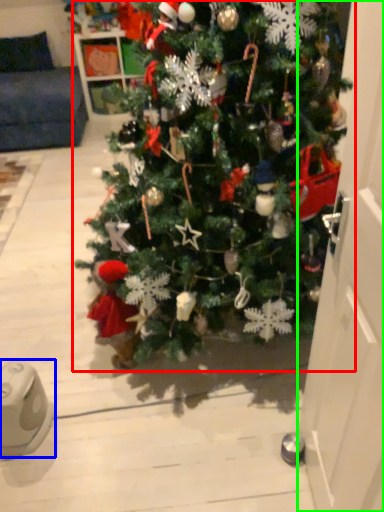
Question: Which object is positioned farthest from christmas tree (highlighted by a red box)? Select from ipod (highlighted by a blue box) and door (highlighted by a green box).

Choices:
 (A) ipod
 (B) door

Answer: (A)